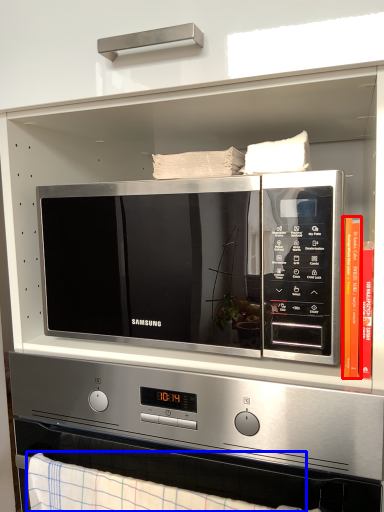
Question: Which object appears farthest to the camera in this image, book (highlighted by a red box) or blanket (highlighted by a blue box)?

Choices:
 (A) book
 (B) blanket

Answer: (A)